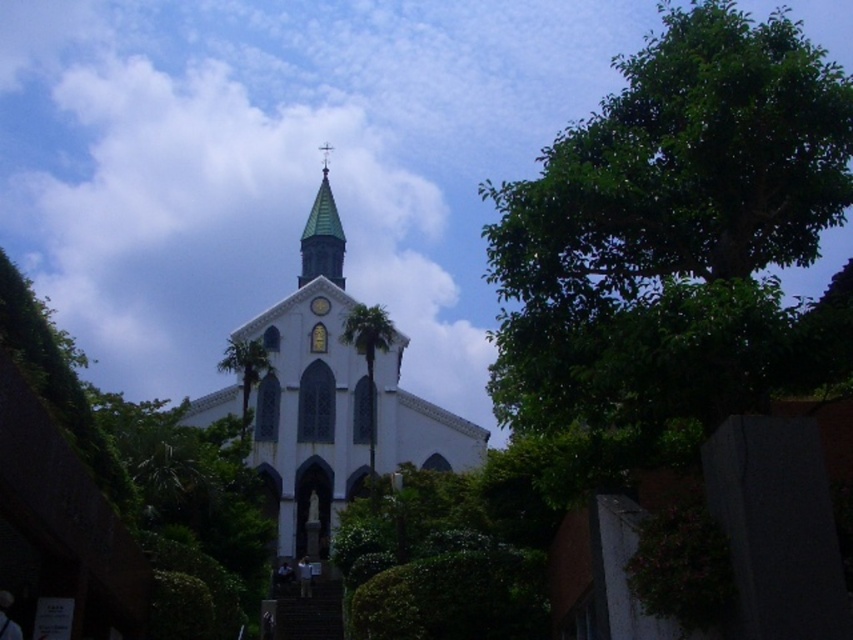
Question: Which point is closer to the camera taking this photo?

Choices:
 (A) (665, 8)
 (B) (368, 333)

Answer: (B)

Question: Can you confirm if white smooth church at center is thinner than green leafy tree at center?

Choices:
 (A) no
 (B) yes

Answer: (A)

Question: Which of the following is the closest to the observer?

Choices:
 (A) (367, 326)
 (B) (233, 358)

Answer: (A)

Question: Can you confirm if green leafy tree at upper right is wider than white glossy clock at upper center?

Choices:
 (A) no
 (B) yes

Answer: (B)

Question: Which point is farther from the camera taking this photo?

Choices:
 (A) (779, 112)
 (B) (340, 310)
 (C) (242, 346)

Answer: (B)

Question: Is white smooth church at center wider than green leafy tree at center?

Choices:
 (A) no
 (B) yes

Answer: (B)